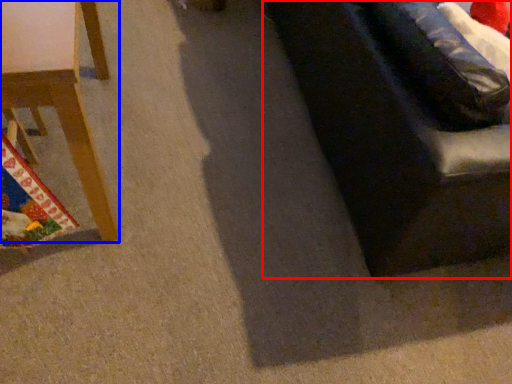
Question: Which object is closer to the camera taking this photo, studio couch (highlighted by a red box) or furniture (highlighted by a blue box)?

Choices:
 (A) studio couch
 (B) furniture

Answer: (B)